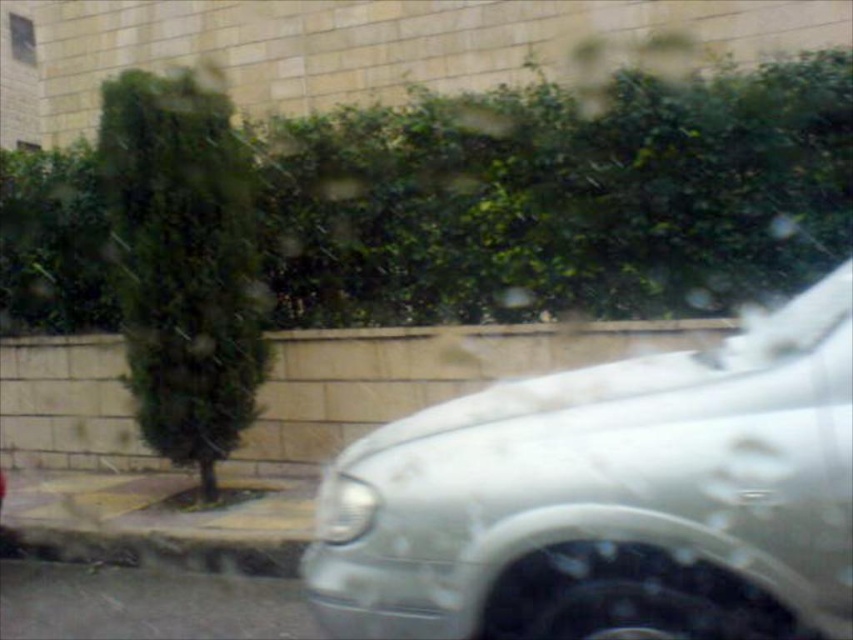
Question: Can you confirm if white glossy car at right is thinner than gray concrete curb at lower left?

Choices:
 (A) no
 (B) yes

Answer: (B)

Question: Among these points, which one is farthest from the camera?

Choices:
 (A) (604, 538)
 (B) (123, 538)

Answer: (B)

Question: Does white glossy car at right have a larger size compared to gray concrete curb at lower left?

Choices:
 (A) yes
 (B) no

Answer: (A)

Question: Is white glossy car at right to the left of gray concrete curb at lower left from the viewer's perspective?

Choices:
 (A) yes
 (B) no

Answer: (B)